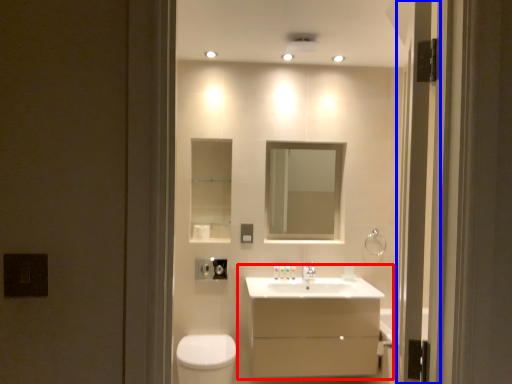
Question: Which of the following is the closest to the observer, bathroom cabinet (highlighted by a red box) or screen door (highlighted by a blue box)?

Choices:
 (A) bathroom cabinet
 (B) screen door

Answer: (B)